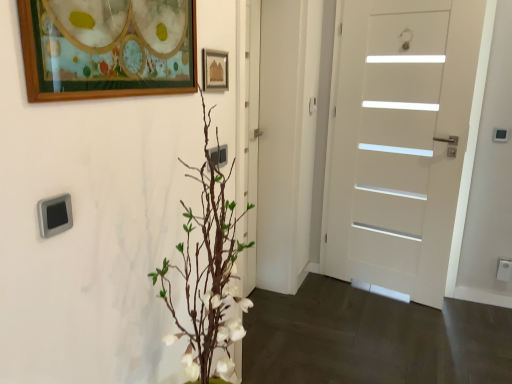
Question: From the image's perspective, relative to wooden picture frame at upper center, the first picture frame when ordered from right to left, is satin silver outlet at center, the 1th electric outlet viewed from the left, above or below?

Choices:
 (A) above
 (B) below

Answer: (B)

Question: Is satin silver outlet at center, the second electric outlet when ordered from bottom to top, inside or outside of wooden picture frame at upper center, the first picture frame when ordered from right to left?

Choices:
 (A) outside
 (B) inside

Answer: (A)

Question: Considering the real-world distances, which object is closest to the wooden picture frame at upper left, the first picture frame in the front-to-back sequence?

Choices:
 (A) wooden picture frame at upper center, the first picture frame when ordered from right to left
 (B) satin silver switch at upper left
 (C) satin silver door handle at upper center
 (D) white matte door at right
 (E) satin silver outlet at center, the second electric outlet when ordered from bottom to top

Answer: (A)

Question: Estimate the real-world distances between objects in this image. Which object is farther from the white matte vase at lower left?

Choices:
 (A) white plastic electric outlet at lower right, the second electric outlet from the left
 (B) satin silver door handle at upper center
 (C) white matte door at right
 (D) wooden picture frame at upper center, acting as the first picture frame starting from the back
 (E) wooden picture frame at upper left, the 2th picture frame when ordered from back to front

Answer: (E)